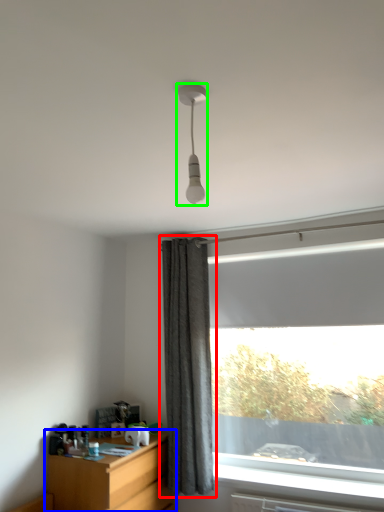
Question: Which object is positioned farthest from curtain (highlighted by a red box)? Select from desk (highlighted by a blue box) and lamp (highlighted by a green box).

Choices:
 (A) desk
 (B) lamp

Answer: (B)